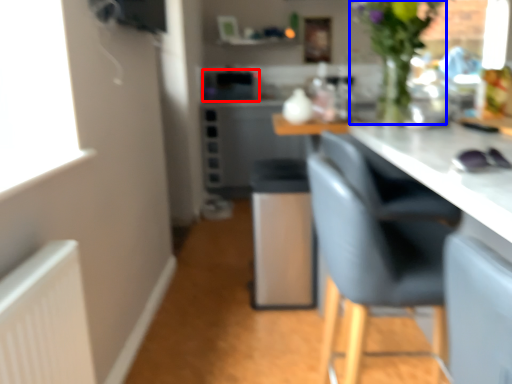
Question: Among these objects, which one is nearest to the camera, appliance (highlighted by a red box) or floral arrangement (highlighted by a blue box)?

Choices:
 (A) appliance
 (B) floral arrangement

Answer: (B)